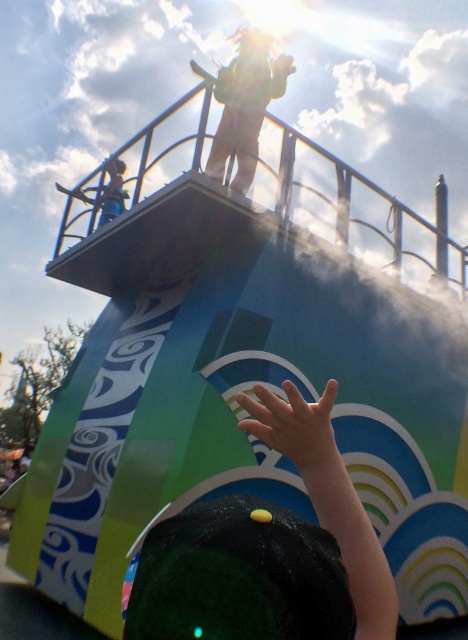
Question: Among these objects, which one is nearest to the camera?

Choices:
 (A) metallic silver helmet at upper left
 (B) green fabric shirt at upper center

Answer: (B)

Question: Which point appears closest to the camera in this image?

Choices:
 (A) (173, 524)
 (B) (305, 420)
 (C) (247, 154)
 (D) (107, 193)

Answer: (A)

Question: Can you confirm if green fabric shirt at upper center is wider than metallic silver helmet at upper left?

Choices:
 (A) no
 (B) yes

Answer: (B)

Question: Is dark green fabric hand at lower center bigger than green fabric shirt at upper center?

Choices:
 (A) yes
 (B) no

Answer: (B)

Question: Is dark green fabric hand at lower center to the right of metallic silver helmet at upper left from the viewer's perspective?

Choices:
 (A) yes
 (B) no

Answer: (A)

Question: Among these points, which one is nearest to the camera?

Choices:
 (A) (333, 433)
 (B) (234, 113)

Answer: (A)